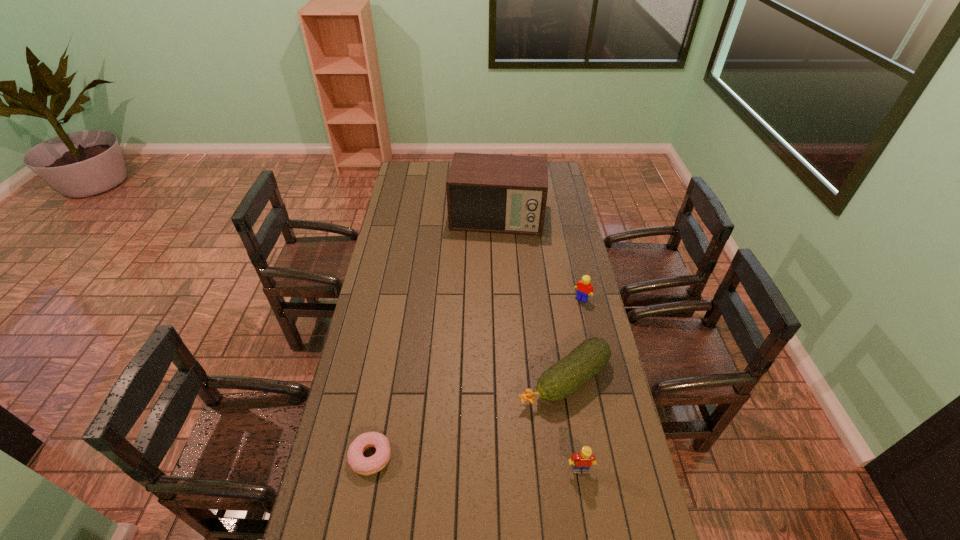
The width and height of the screenshot is (960, 540). I want to click on free spot on the desktop that is between the shortest object and the nearer Lego and is positioned on the front-facing side of the tallest object, so click(x=468, y=462).

The width and height of the screenshot is (960, 540). What are the coordinates of `vacant space on the desktop that is between the leftmost object and the nearer Lego and is positioned on the front-facing side of the farther Lego` in the screenshot? It's located at (458, 462).

Find the location of a particular element. This screenshot has width=960, height=540. vacant space on the desktop that is between the leftmost object and the left Lego and is positioned at the blossom end of the cucumber is located at coordinates (449, 461).